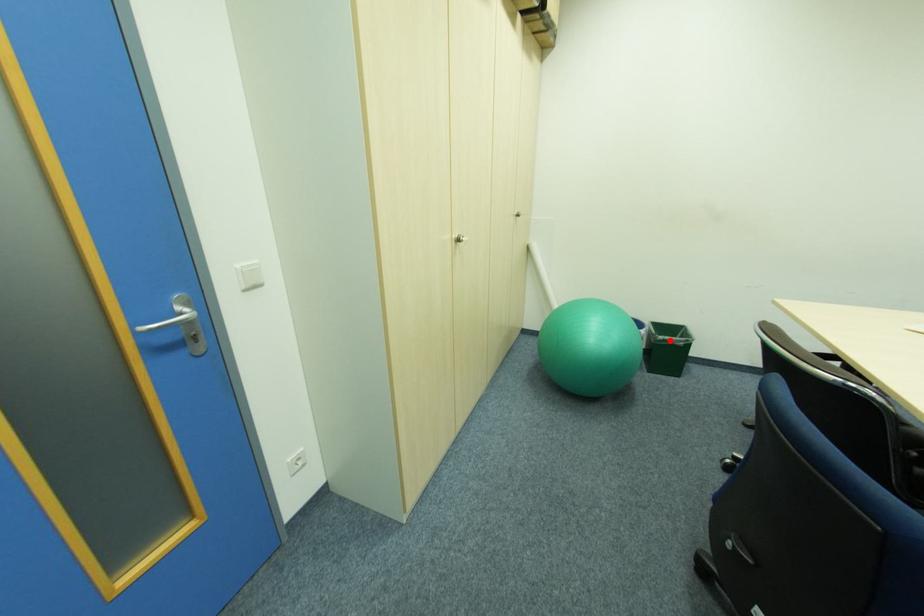
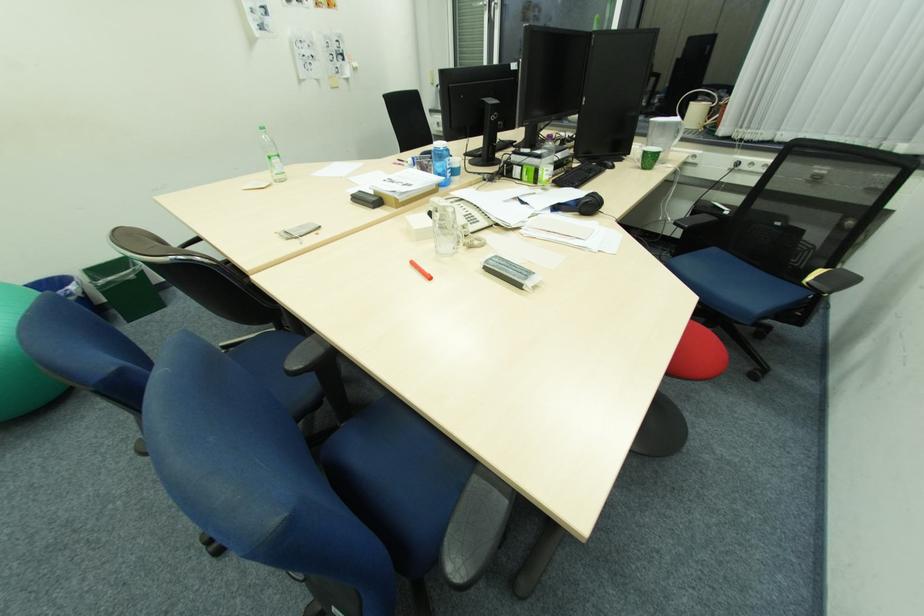
The point at the highlighted location is marked in the first image. Where is the corresponding point in the second image?

(115, 284)